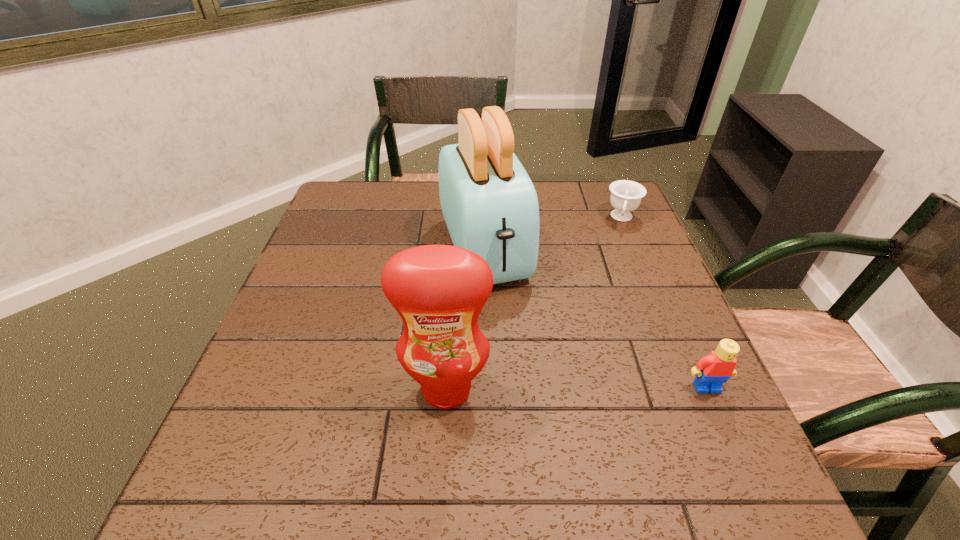
Image resolution: width=960 pixels, height=540 pixels. I want to click on vacant space that's between the toaster and the teacup, so click(x=553, y=234).

Find the location of a particular element. The height and width of the screenshot is (540, 960). object that ranks as the closest to the toaster is located at coordinates (439, 291).

This screenshot has height=540, width=960. I want to click on object that ranks as the closest to the teacup, so click(490, 206).